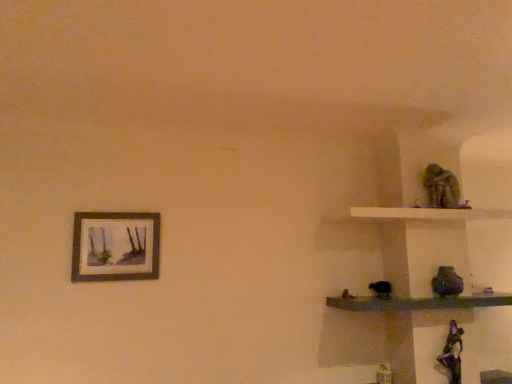
Question: Is smooth dark wood shelf at right, the second shelf when ordered from top to bottom, situated inside green mossy statue at upper right or outside?

Choices:
 (A) outside
 (B) inside

Answer: (A)

Question: Is smooth dark wood shelf at right, placed as the 1th shelf when sorted from bottom to top, in front of or behind green mossy statue at upper right in the image?

Choices:
 (A) behind
 (B) front

Answer: (B)

Question: Which is nearer to the smooth dark wood shelf at right, placed as the 1th shelf when sorted from bottom to top?

Choices:
 (A) green mossy statue at upper right
 (B) white matte shelf at upper right, which appears as the 1th shelf when viewed from the top
 (C) matte wooden picture frame at upper left

Answer: (B)

Question: Considering the real-world distances, which object is closest to the matte wooden picture frame at upper left?

Choices:
 (A) green mossy statue at upper right
 (B) smooth dark wood shelf at right, the second shelf when ordered from top to bottom
 (C) white matte shelf at upper right, which ranks as the second shelf in bottom-to-top order

Answer: (B)